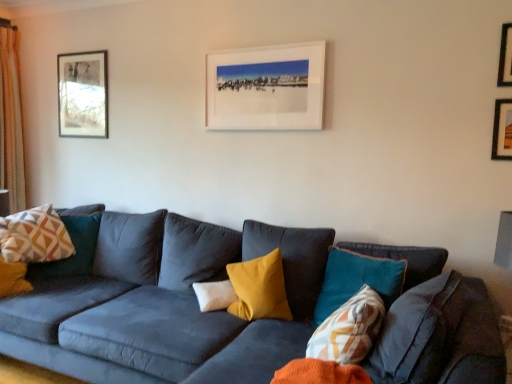
Question: Does point (503, 67) appear closer or farther from the camera than point (60, 132)?

Choices:
 (A) closer
 (B) farther

Answer: (A)

Question: Considering their positions, is metallic gold picture frame at upper right, the fourth picture frame when ordered from left to right, located in front of or behind wooden framed picture at upper left, the fourth picture frame positioned from the right?

Choices:
 (A) front
 (B) behind

Answer: (A)

Question: Which object is positioned farthest from the wooden framed picture at upper left, which appears as the fourth picture frame when viewed from the front?

Choices:
 (A) white matte picture frame at upper center, which ranks as the third picture frame in right-to-left order
 (B) metallic gold picture frame at upper right, the fourth picture frame when ordered from left to right
 (C) light beige textured curtain at left
 (D) geometric-patterned fabric pillow at left, the third pillow from the front
 (E) wooden picture frame at upper right, which ranks as the second picture frame in right-to-left order

Answer: (E)

Question: Which is nearer to the geometric-patterned fabric pillow at left, the third pillow from the front?

Choices:
 (A) metallic gold picture frame at upper right, which is the fourth picture frame from back to front
 (B) patterned fabric pillow at center, which ranks as the first pillow in front-to-back order
 (C) wooden picture frame at upper right, arranged as the third picture frame when viewed from the left
 (D) white soft pillow at center, acting as the second pillow starting from the left
 (E) light beige textured curtain at left

Answer: (E)